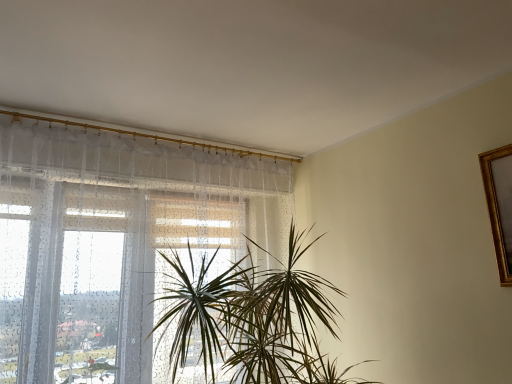
Question: From the image's perspective, relative to green leafy plant at center, is transparent fabric at left above or below?

Choices:
 (A) below
 (B) above

Answer: (B)

Question: From a real-world perspective, is transparent fabric at left positioned above or below green leafy plant at center?

Choices:
 (A) above
 (B) below

Answer: (A)

Question: Looking at the image, does transparent fabric at left seem bigger or smaller compared to green leafy plant at center?

Choices:
 (A) big
 (B) small

Answer: (B)

Question: Is green leafy plant at center bigger or smaller than transparent fabric at left?

Choices:
 (A) big
 (B) small

Answer: (A)

Question: Considering their positions, is green leafy plant at center located in front of or behind transparent fabric at left?

Choices:
 (A) front
 (B) behind

Answer: (A)

Question: From the image's perspective, relative to transparent fabric at left, is green leafy plant at center above or below?

Choices:
 (A) above
 (B) below

Answer: (B)

Question: Considering the positions of green leafy plant at center and transparent fabric at left in the image, is green leafy plant at center taller or shorter than transparent fabric at left?

Choices:
 (A) tall
 (B) short

Answer: (B)